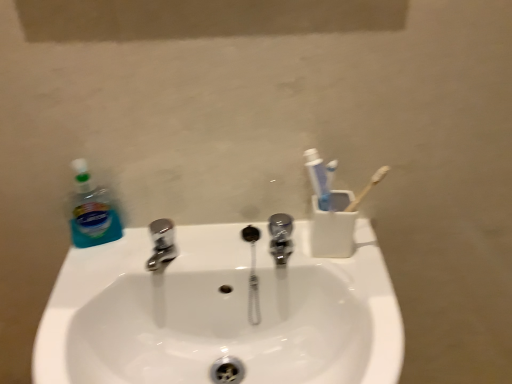
Question: Can you confirm if white glossy sink at center is bigger than blue translucent liquid at left?

Choices:
 (A) yes
 (B) no

Answer: (A)

Question: Is white glossy sink at center touching blue translucent liquid at left?

Choices:
 (A) yes
 (B) no

Answer: (B)

Question: Is white glossy sink at center outside blue translucent liquid at left?

Choices:
 (A) yes
 (B) no

Answer: (A)

Question: Is white glossy sink at center further to the viewer compared to blue translucent liquid at left?

Choices:
 (A) no
 (B) yes

Answer: (A)

Question: From a real-world perspective, is white glossy sink at center below blue translucent liquid at left?

Choices:
 (A) yes
 (B) no

Answer: (A)

Question: Is white glossy sink at center shorter than blue translucent liquid at left?

Choices:
 (A) no
 (B) yes

Answer: (A)

Question: From the image's perspective, does white glossy sink at center appear higher than white plastic toothbrush holder at upper right?

Choices:
 (A) no
 (B) yes

Answer: (A)

Question: Could you tell me if white glossy sink at center is facing white plastic toothbrush holder at upper right?

Choices:
 (A) no
 (B) yes

Answer: (A)

Question: Would you say white glossy sink at center is outside white plastic toothbrush holder at upper right?

Choices:
 (A) no
 (B) yes

Answer: (B)

Question: Is white glossy sink at center further to the viewer compared to white plastic toothbrush holder at upper right?

Choices:
 (A) yes
 (B) no

Answer: (B)

Question: Can you confirm if white glossy sink at center is thinner than white plastic toothbrush holder at upper right?

Choices:
 (A) yes
 (B) no

Answer: (B)

Question: Can you confirm if white glossy sink at center is smaller than white plastic toothbrush holder at upper right?

Choices:
 (A) yes
 (B) no

Answer: (B)

Question: Can you see white plastic toothbrush holder at upper right touching polished chrome tap at center?

Choices:
 (A) yes
 (B) no

Answer: (A)